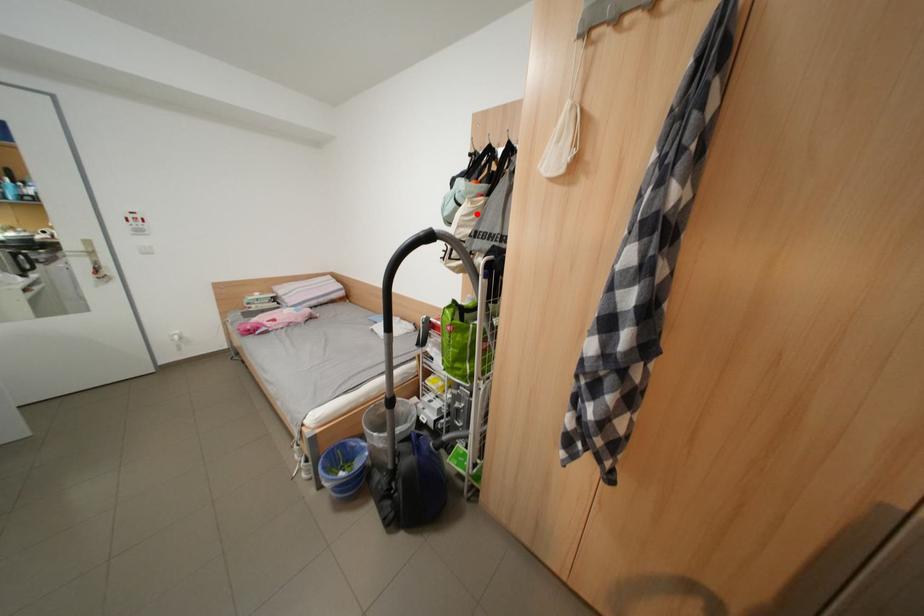
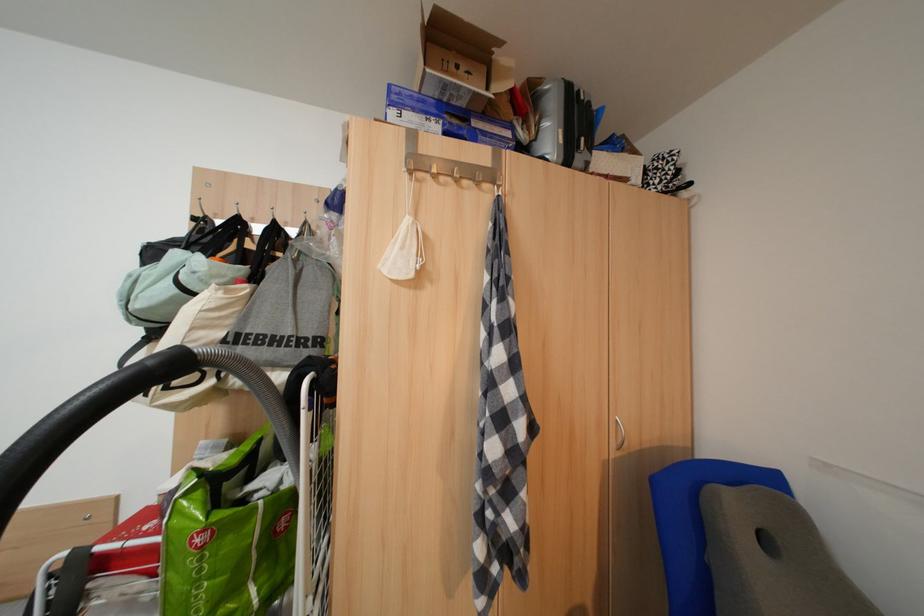
The point at the highlighted location is marked in the first image. Where is the corresponding point in the second image?

(224, 307)